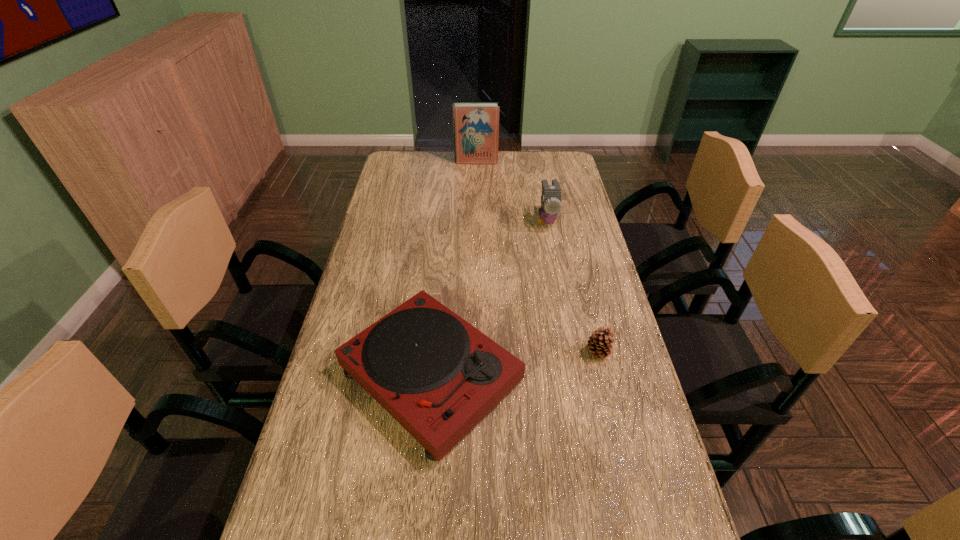
You are a GUI agent. You are given a task and a screenshot of the screen. Output one action in this format:
    pyautogui.click(x=<x>, y=<y>)
    Task: Click on the free spot that satisfies the following two spatial constraints: 1. at the beak of the pinecone; 2. on the right side of the third nearest object
    This screenshot has height=540, width=960.
    Given the screenshot: What is the action you would take?
    pyautogui.click(x=571, y=352)

Where is `blank area in the image that satisfies the following two spatial constraints: 1. on the back side of the record player; 2. on the left side of the pinecone`? The width and height of the screenshot is (960, 540). blank area in the image that satisfies the following two spatial constraints: 1. on the back side of the record player; 2. on the left side of the pinecone is located at coordinates (433, 352).